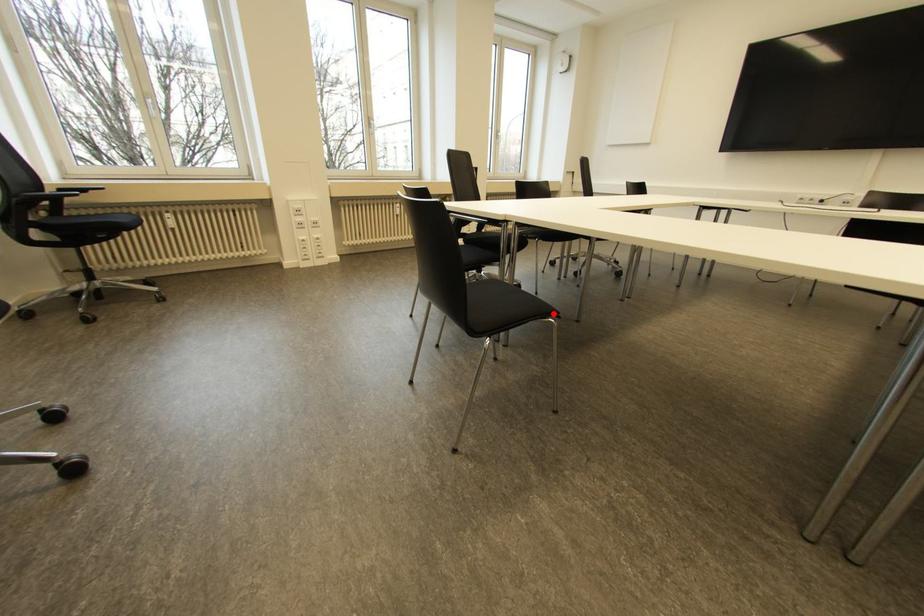
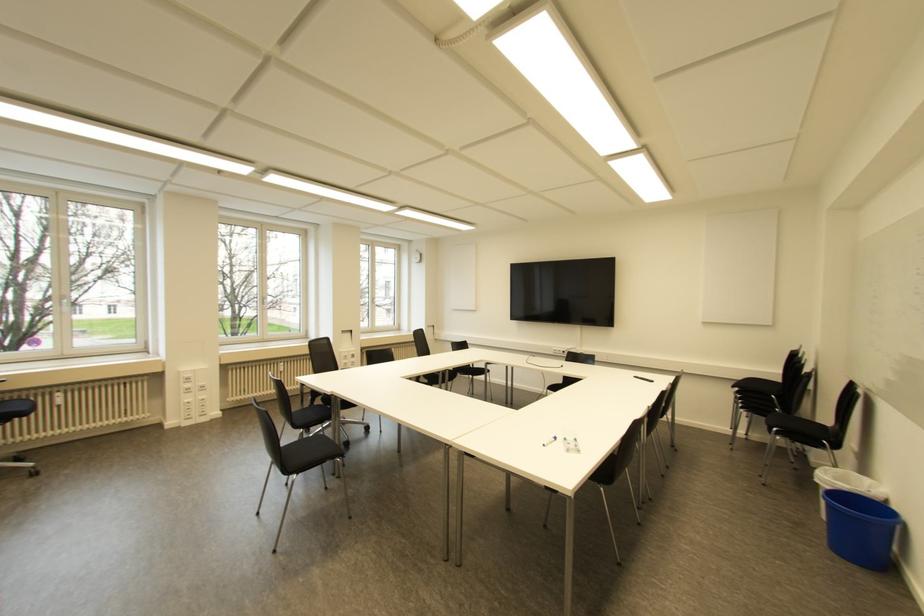
Question: I am providing you with two images of the same scene from different viewpoints. A red point is shown in image1. For the corresponding object point in image2, is it positioned nearer or farther from the camera?

Choices:
 (A) Nearer
 (B) Farther

Answer: (A)